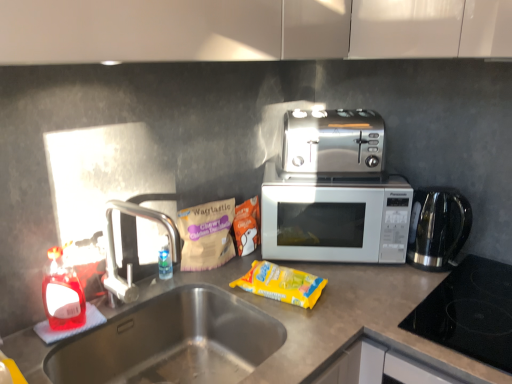
Where is `empty space that is ontop of black glass cooktop at lower right`? empty space that is ontop of black glass cooktop at lower right is located at coordinates (475, 301).